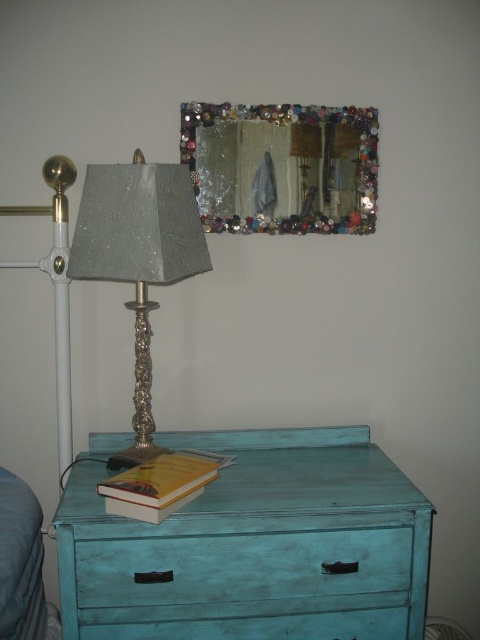
Is the position of shiny silver lamp at left less distant than that of yellow paperback book at lower center?

No.

Can you confirm if shiny silver lamp at left is bigger than yellow paperback book at lower center?

Yes.

Locate an element on the screen. Image resolution: width=480 pixels, height=640 pixels. shiny silver lamp at left is located at coordinates (137, 257).

Which is more to the left, turquoise distressed wood table at lower center or teal painted wood drawer at center?

From the viewer's perspective, turquoise distressed wood table at lower center appears more on the left side.

Does turquoise distressed wood table at lower center have a greater height compared to teal painted wood drawer at center?

Yes.

Is point (60, 538) in front of point (144, 568)?

Yes, it is.

Where is `turquoise distressed wood table at lower center`? turquoise distressed wood table at lower center is located at coordinates (254, 547).

Can you confirm if decorative glass mirror at upper center is bigger than shiny silver lamp at left?

No.

Between point (267, 211) and point (112, 250), which one is positioned behind?

The point (267, 211) is more distant.

What do you see at coordinates (282, 166) in the screenshot? The image size is (480, 640). I see `decorative glass mirror at upper center` at bounding box center [282, 166].

Image resolution: width=480 pixels, height=640 pixels. Find the location of `decorative glass mirror at upper center`. decorative glass mirror at upper center is located at coordinates (282, 166).